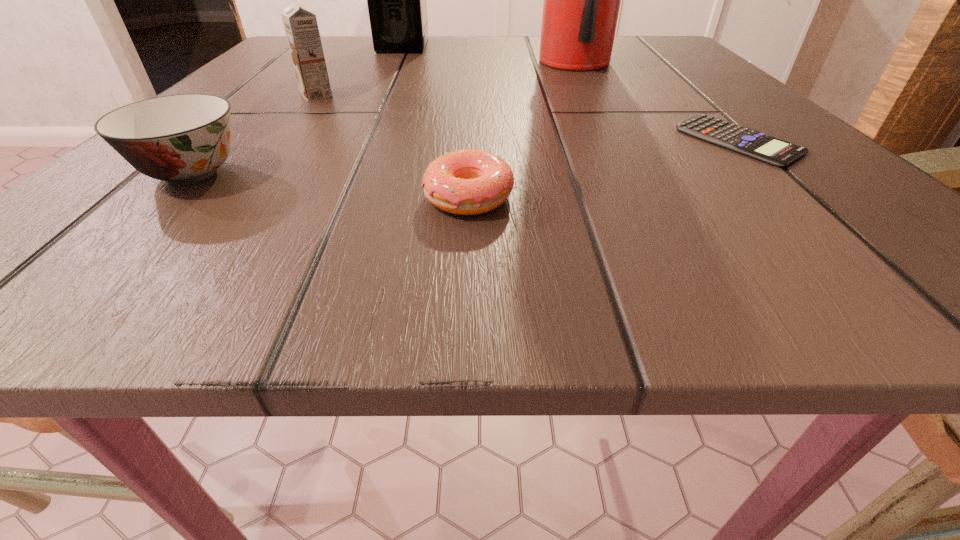
Where is `free location that satisfies the following two spatial constraints: 1. on the back side of the rightmost object; 2. on the front label of the fifth shortest object`? The image size is (960, 540). free location that satisfies the following two spatial constraints: 1. on the back side of the rightmost object; 2. on the front label of the fifth shortest object is located at coordinates (639, 45).

In order to click on free spot that satisfies the following two spatial constraints: 1. on the back side of the fourth object from left to right; 2. on the front label of the third object from left to right in this screenshot , I will do `click(474, 45)`.

Locate an element on the screen. Image resolution: width=960 pixels, height=540 pixels. free location that satisfies the following two spatial constraints: 1. on the front label of the rightmost object; 2. on the right side of the fourth object from right to left is located at coordinates (354, 141).